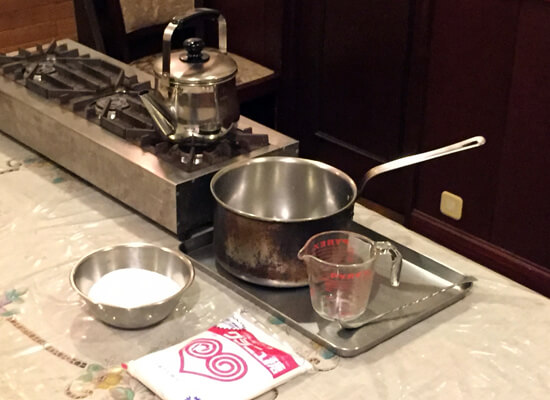
Locate an element on the screen. tables is located at coordinates (251, 317).